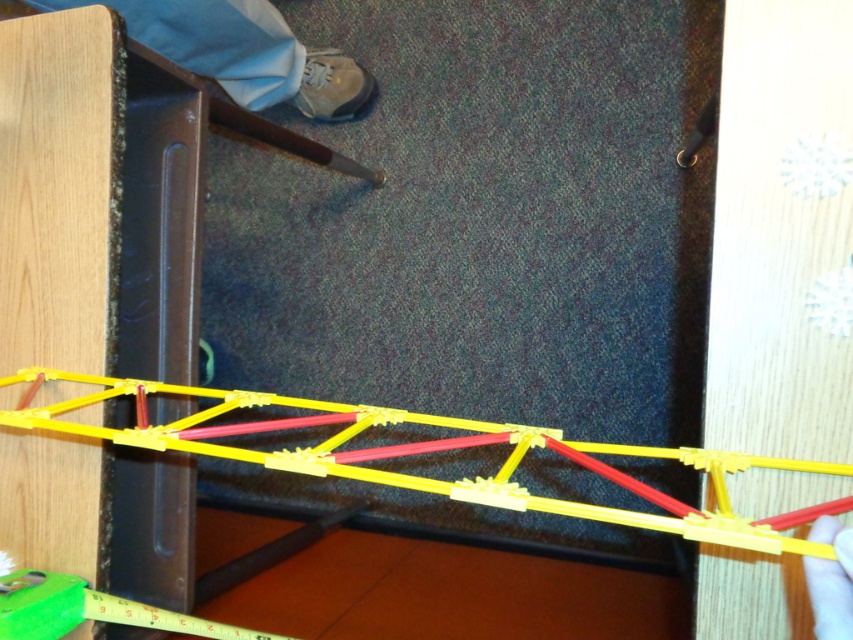
Who is shorter, yellow plastic bridge at center or light blue fabric pants at lower left?

With less height is light blue fabric pants at lower left.

Is yellow plastic bridge at center shorter than light blue fabric pants at lower left?

In fact, yellow plastic bridge at center may be taller than light blue fabric pants at lower left.

You are a GUI agent. You are given a task and a screenshot of the screen. Output one action in this format:
    pyautogui.click(x=<x>, y=<y>)
    Task: Click on the yellow plastic bridge at center
    The image size is (853, 640).
    Given the screenshot: What is the action you would take?
    pyautogui.click(x=431, y=451)

Is light blue fabric pants at lower left behind smooth plastic hand at lower right?

Yes, it is.

Does light blue fabric pants at lower left have a greater width compared to smooth plastic hand at lower right?

Indeed, light blue fabric pants at lower left has a greater width compared to smooth plastic hand at lower right.

Is point (225, 49) positioned before point (828, 541)?

No, (225, 49) is further to viewer.

Locate an element on the screen. The width and height of the screenshot is (853, 640). light blue fabric pants at lower left is located at coordinates (242, 52).

Does point (498, 506) lie behind point (840, 544)?

Yes, point (498, 506) is farther from viewer.

Who is more forward, (848, 504) or (819, 534)?

Point (819, 534) is more forward.

Locate an element on the screen. Image resolution: width=853 pixels, height=640 pixels. yellow plastic bridge at center is located at coordinates (431, 451).